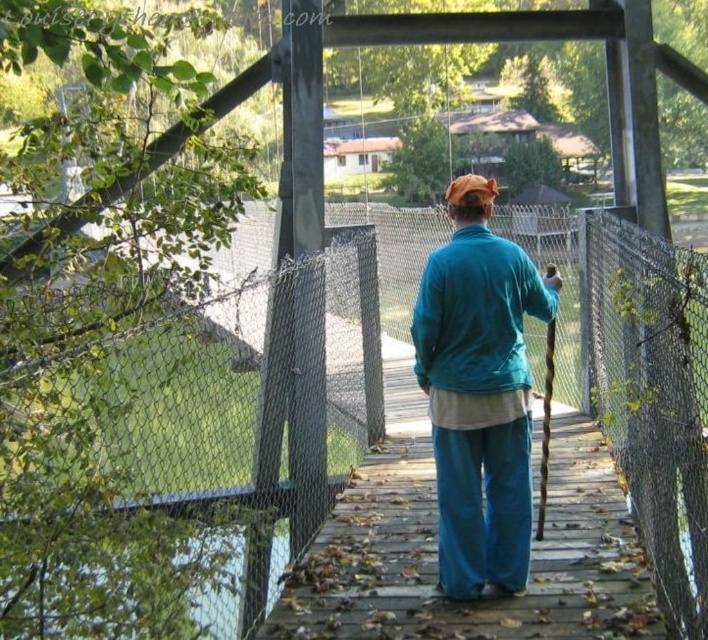
From the picture: You are standing on the wooden suspension bridge and see two points marked on the bridge floor. The first point is at coordinates point (508, 509) and the second is at point (88, 513). Which point is closer to you as you look down at the bridge floor?

Point (508, 509) is further to the viewer than point (88, 513), so the point closer to you is point (88, 513).

You are standing on the wooden suspension bridge and notice the teal velvety jacket at center and the clear water at lower left. Which object is wider in terms of visual representation?

The teal velvety jacket at center is wider than clear water at lower left.

You are standing on the wooden suspension bridge and see the teal velvety jacket at center and the clear water at lower left. Which object is higher in elevation?

The teal velvety jacket at center is much taller than the clear water at lower left, so the teal velvety jacket at center is higher in elevation.